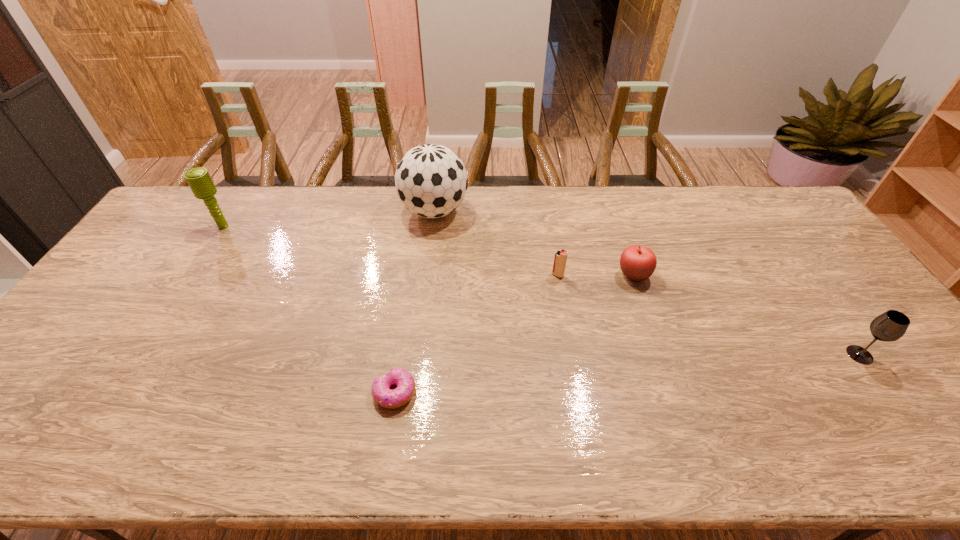
Locate an element on the screen. This screenshot has width=960, height=540. soccer ball is located at coordinates (431, 180).

At what (x,y) coordinates should I click in order to perform the action: click on microphone. Please return your answer as a coordinate pair (x, y). Looking at the image, I should click on (199, 180).

Identify the location of the rightmost object. click(890, 326).

The image size is (960, 540). I want to click on the second nearest object, so click(890, 326).

This screenshot has width=960, height=540. I want to click on apple, so click(x=638, y=263).

At what (x,y) coordinates should I click in order to perform the action: click on igniter. Please return your answer as a coordinate pair (x, y). Looking at the image, I should click on pyautogui.click(x=560, y=258).

This screenshot has height=540, width=960. I want to click on doughnut, so click(x=382, y=394).

Where is `the nearest object`? the nearest object is located at coordinates (382, 394).

Locate an element on the screen. This screenshot has width=960, height=540. vacant space located on the left of the soccer ball is located at coordinates (383, 211).

Where is `vacant region located on the front of the leftmost object`? The height and width of the screenshot is (540, 960). vacant region located on the front of the leftmost object is located at coordinates (196, 272).